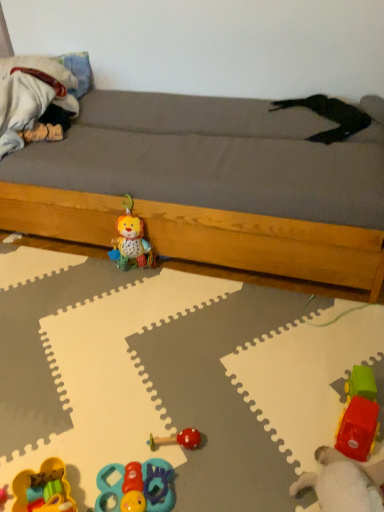
The height and width of the screenshot is (512, 384). In order to click on vacant space in between rubberized blue and red toy at lower center, arranged as the 4th toy when viewed from the right, and smooth plastic rattle at center, acting as the fourth toy starting from the left in this screenshot , I will do `click(150, 457)`.